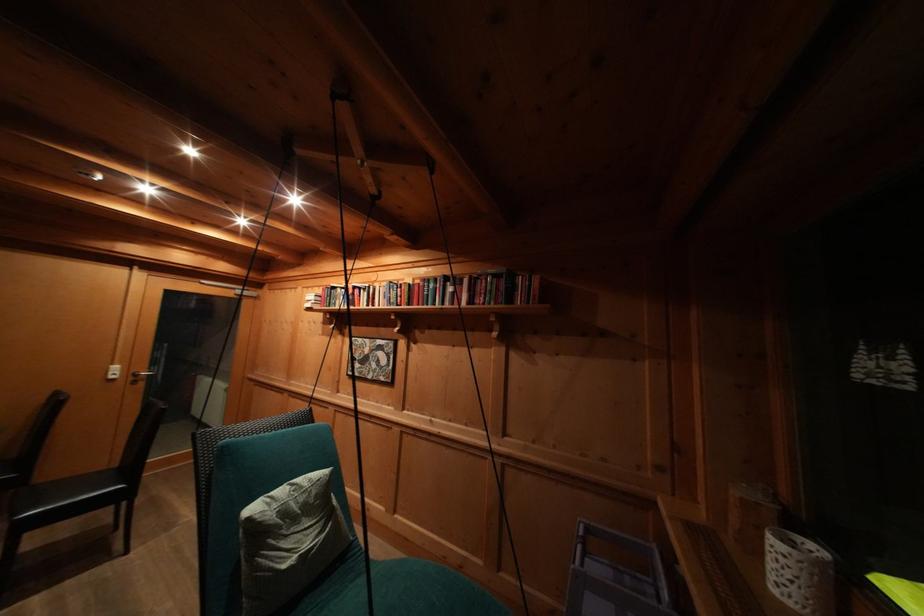
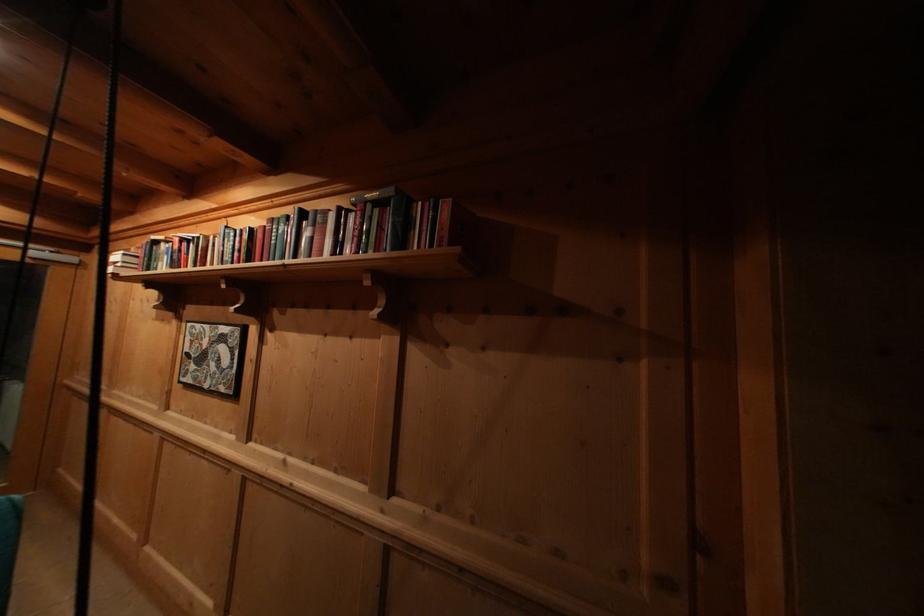
Find the pixel in the second image that matches [406,294] in the first image.

(244, 245)